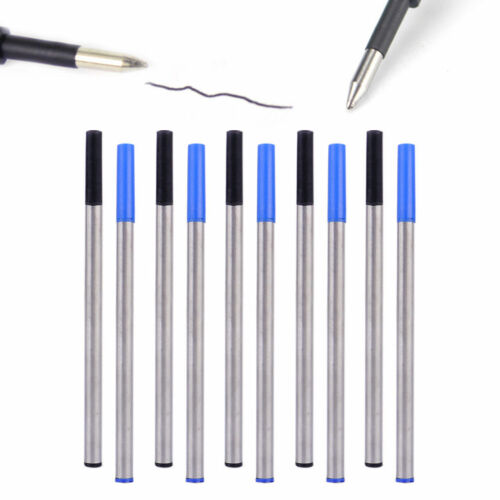
You are a GUI agent. You are given a task and a screenshot of the screen. Output one action in this format:
    pyautogui.click(x=<x>, y=<y>)
    Task: Click on the pens with black lids
    
    Given the screenshot: What is the action you would take?
    pyautogui.click(x=90, y=168), pyautogui.click(x=162, y=167), pyautogui.click(x=232, y=176), pyautogui.click(x=305, y=172), pyautogui.click(x=377, y=174)